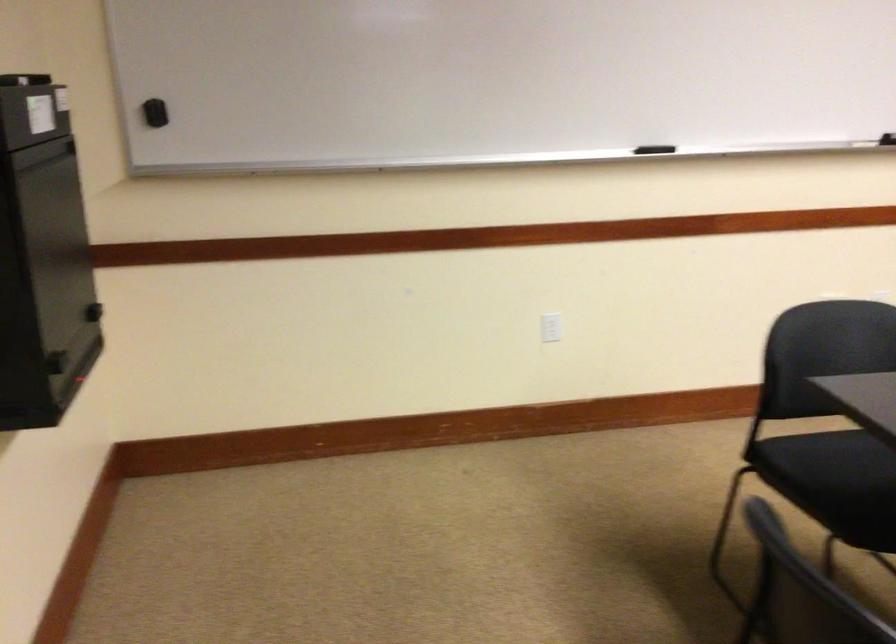
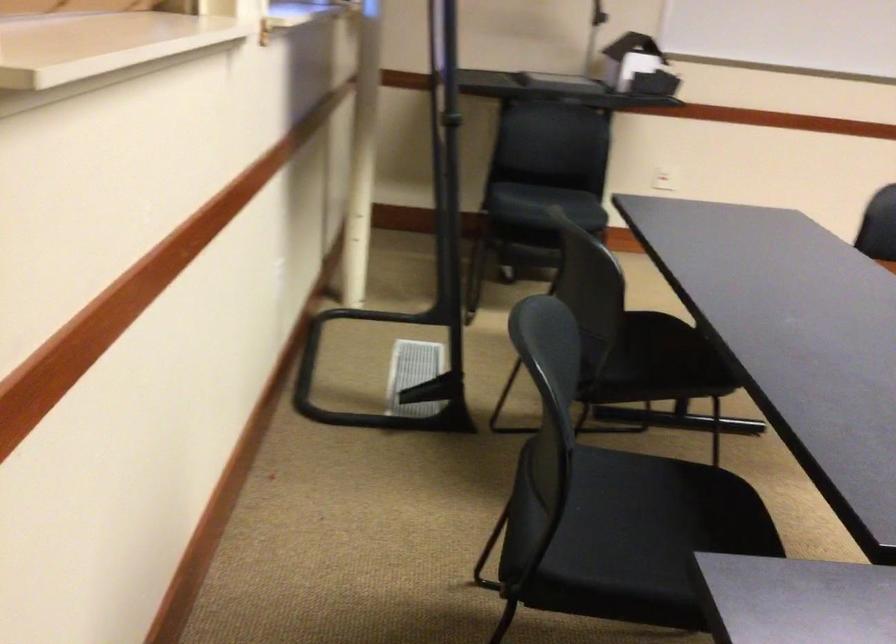
How did the camera likely rotate?

The camera's rotation is toward right-down.